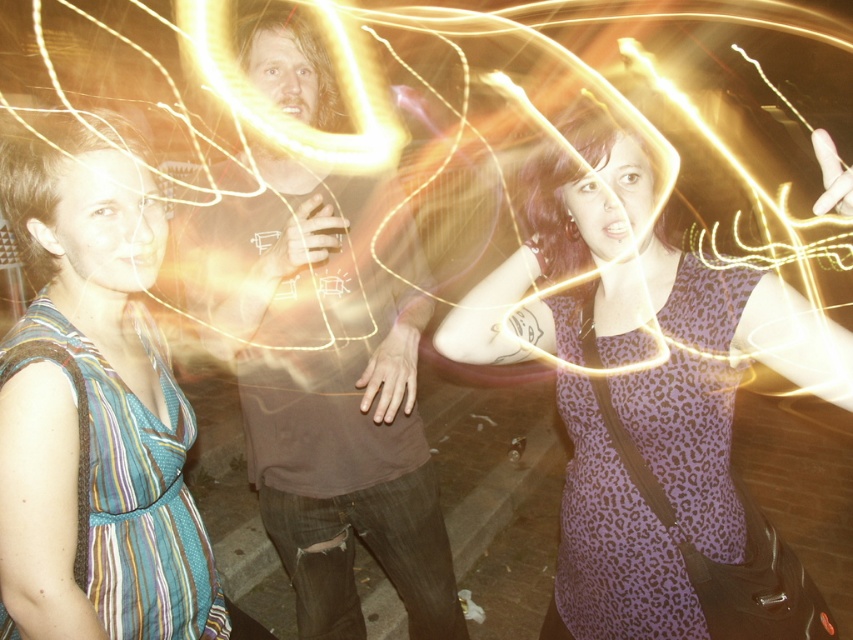
Consider the image. Does purple leopard print dress at center appear over striped fabric dress at left?

Yes.

Describe the element at coordinates (639, 385) in the screenshot. The width and height of the screenshot is (853, 640). I see `purple leopard print dress at center` at that location.

The image size is (853, 640). In order to click on purple leopard print dress at center in this screenshot , I will do `click(639, 385)`.

Looking at this image, between purple leopard print dress at center and brown cotton shirt at center, which one has less height?

purple leopard print dress at center

Between purple leopard print dress at center and brown cotton shirt at center, which one appears on the right side from the viewer's perspective?

Positioned to the right is purple leopard print dress at center.

Between point (686, 298) and point (308, 195), which one is positioned behind?

The point (308, 195) is behind.

Image resolution: width=853 pixels, height=640 pixels. What are the coordinates of `purple leopard print dress at center` in the screenshot? It's located at (639, 385).

Which of these two, brown cotton shirt at center or striped fabric dress at left, stands shorter?

With less height is striped fabric dress at left.

Is brown cotton shirt at center to the right of striped fabric dress at left from the viewer's perspective?

Indeed, brown cotton shirt at center is positioned on the right side of striped fabric dress at left.

Measure the distance between point (241, 49) and camera.

Point (241, 49) is 5.55 feet from camera.

Find the location of a particular element. brown cotton shirt at center is located at coordinates (329, 387).